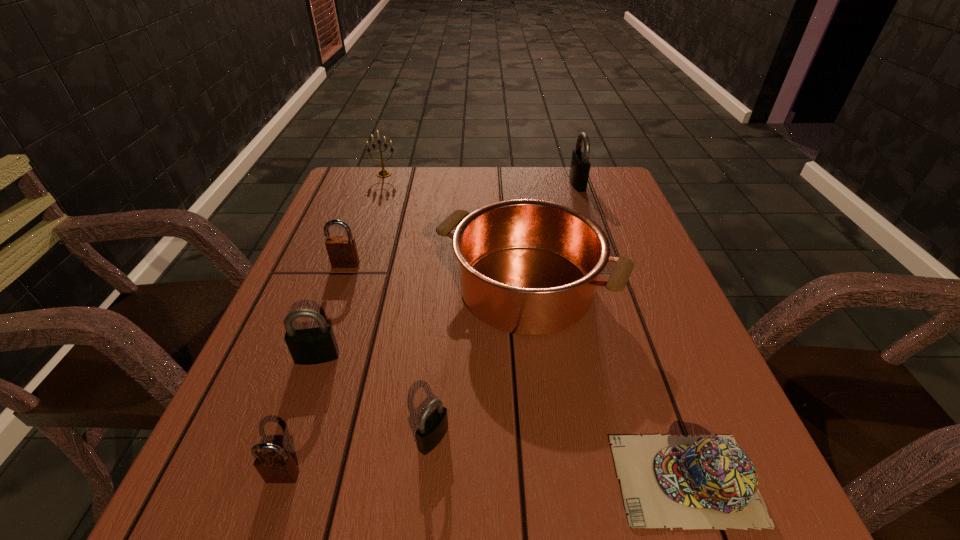
Find the location of a particular element. The image size is (960, 540). cap at the right edge is located at coordinates (700, 482).

Image resolution: width=960 pixels, height=540 pixels. Find the location of `object located in the far left corner section of the desktop`. object located in the far left corner section of the desktop is located at coordinates (383, 173).

Find the location of a particular element. The image size is (960, 540). object located in the near left corner section of the desktop is located at coordinates (274, 467).

I want to click on object located in the far right corner section of the desktop, so (580, 165).

You are a GUI agent. You are given a task and a screenshot of the screen. Output one action in this format:
    pyautogui.click(x=<x>, y=<y>)
    Task: Click on the object that is at the near right corner
    The height and width of the screenshot is (540, 960).
    Given the screenshot: What is the action you would take?
    pyautogui.click(x=700, y=482)

In the image, there is a desktop. In order to click on vacant space at the far edge in this screenshot , I will do `click(420, 193)`.

In the image, there is a desktop. At what (x,y) coordinates should I click in order to perform the action: click on free region at the near edge. Please return your answer as a coordinate pair (x, y). Looking at the image, I should click on (590, 518).

In the image, there is a desktop. Identify the location of vacant space at the left edge. This screenshot has width=960, height=540. (361, 267).

At what (x,y) coordinates should I click in order to perform the action: click on vacant region at the right edge of the desktop. Please return your answer as a coordinate pair (x, y). The height and width of the screenshot is (540, 960). Looking at the image, I should click on (663, 325).

Locate an element on the screen. This screenshot has width=960, height=540. vacant space at the far left corner of the desktop is located at coordinates (364, 168).